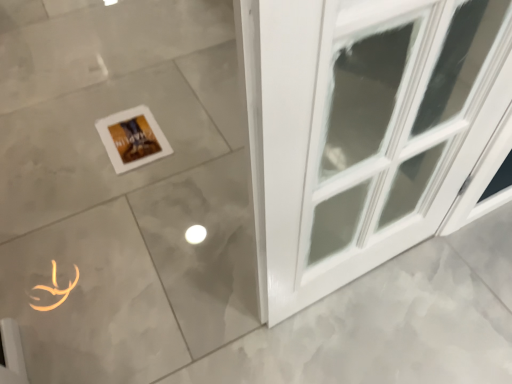
The width and height of the screenshot is (512, 384). I want to click on free space above matte gray tile at center (from a real-world perspective), so click(x=155, y=84).